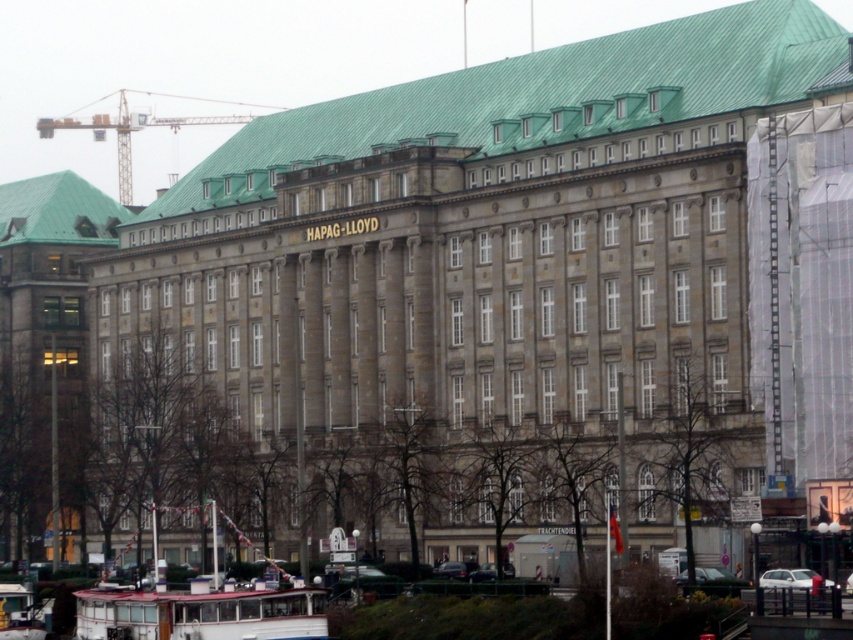
You are a delivery driver trying to navigate through the area in front of the HAPAG LLOYD building. You need to deliver a package to the metallic yellow crane at upper left. There is a white plastic boat at lower left blocking your path. Can you drive around it? Explain why or why not based on the distance between them.

The white plastic boat at lower left is 124.65 meters away from the metallic yellow crane at upper left. Since the boat is relatively small and the distance between them is quite large, you can easily drive around the boat to reach the crane.

You are a delivery person who needs to park your delivery van next to the white plastic boat at lower left. The van is 2 meters wide. Can you park it there without overlapping the metallic yellow crane at upper left?

The white plastic boat at lower left has a lesser width compared to metallic yellow crane at upper left. Since the van is 2 meters wide, but the width of the white plastic boat at lower left is not specified, it is impossible to determine if the van can fit without overlapping the metallic yellow crane at upper left.